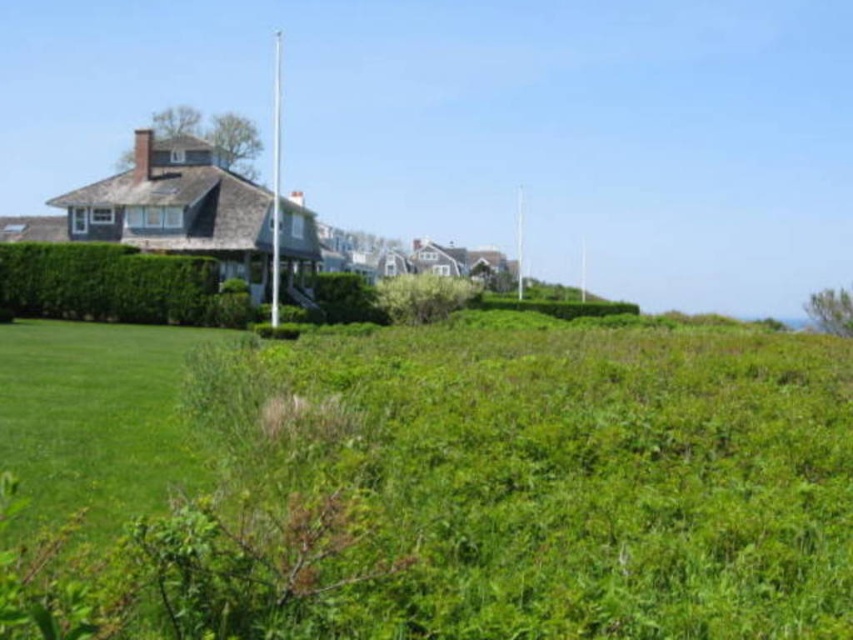
Between green leafy hedge at center and metallic flag pole at center, which one has more height?

Standing taller between the two is metallic flag pole at center.

Can you confirm if green leafy hedge at center is positioned below metallic flag pole at center?

Correct, green leafy hedge at center is located below metallic flag pole at center.

Find the location of `green leafy hedge at center`. green leafy hedge at center is located at coordinates (115, 285).

Between metallic flag pole at center and white metallic flag pole at center, which one has less height?

Standing shorter between the two is white metallic flag pole at center.

Looking at this image, can you confirm if metallic flag pole at center is positioned to the left of white metallic flag pole at center?

Yes, metallic flag pole at center is to the left of white metallic flag pole at center.

Which is in front, point (271, 157) or point (515, 204)?

Point (271, 157) is more forward.

Find the location of `metallic flag pole at center`. metallic flag pole at center is located at coordinates (276, 186).

Who is positioned more to the left, green leafy hedge at center or white metallic flag pole at center?

green leafy hedge at center is more to the left.

Who is lower down, green leafy hedge at center or white metallic flag pole at center?

Positioned lower is green leafy hedge at center.

I want to click on green leafy hedge at center, so pyautogui.click(x=115, y=285).